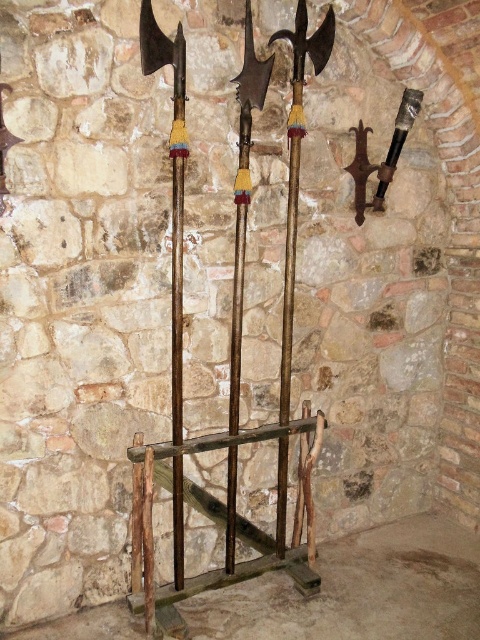
You are a knight preparing to retrieve a weapon from the wooden rack. You see the rusty wood ladder at center and the wooden polished axe at center. Which object is shorter in height?

The rusty wood ladder at center is not as tall as the wooden polished axe at center, so the rusty wood ladder at center is shorter in height.

You are a knight standing in front of the medieval weapons display. You need to reach a shield that is placed on a high shelf. The rusty wood ladder at center is available. Can you safely use the ladder to reach the shield?

The rusty wood ladder at center is located at point (x=228, y=515), so it is positioned in the center of the scene. Since the ladder is centrally placed, it should be accessible for reaching the shield on the high shelf provided it is within the ladder height range.